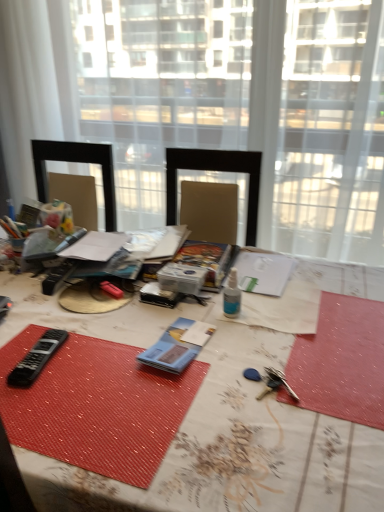
Where is `free space to the right of blue paper at center, which is the second equipment in left-to-right order`? The image size is (384, 512). free space to the right of blue paper at center, which is the second equipment in left-to-right order is located at coordinates (255, 344).